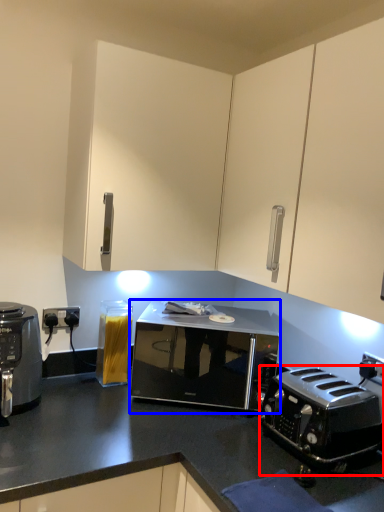
Question: Which object appears closest to the camera in this image, toaster (highlighted by a red box) or microwave oven (highlighted by a blue box)?

Choices:
 (A) toaster
 (B) microwave oven

Answer: (A)